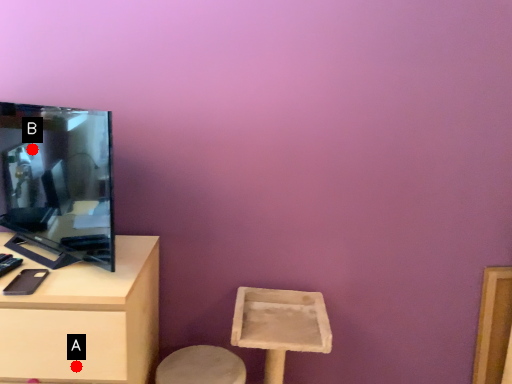
Question: Two points are circled on the image, labeled by A and B beside each circle. Which point is closer to the camera taking this photo?

Choices:
 (A) A is closer
 (B) B is closer

Answer: (A)